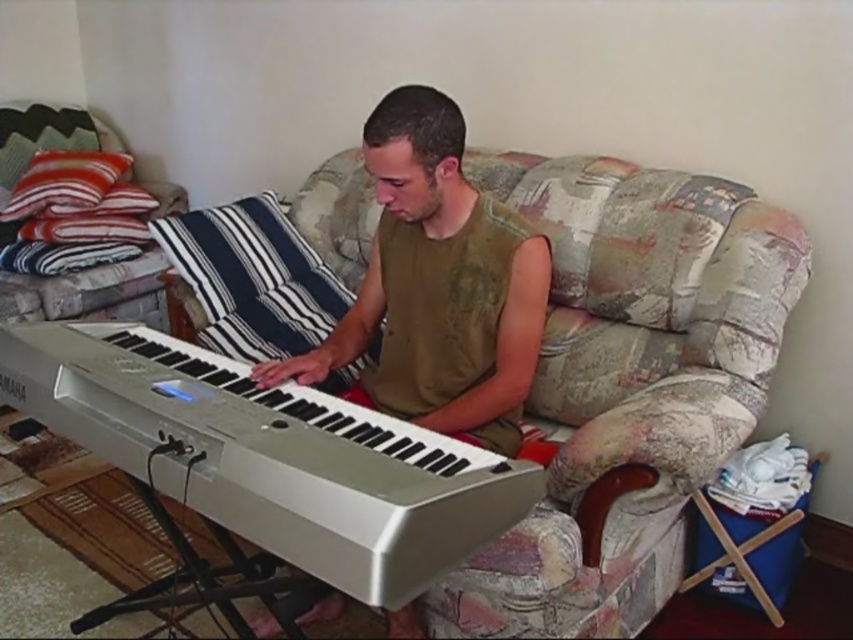
Is white plastic keyboard at center above matte green tank top at center?

Actually, white plastic keyboard at center is below matte green tank top at center.

Is point (178, 492) positioned in front of point (367, 269)?

That is True.

I want to click on white plastic keyboard at center, so pos(270,456).

This screenshot has width=853, height=640. I want to click on white plastic keyboard at center, so click(x=270, y=456).

Is patterned fabric couch at center below white plastic keyboard at center?

No, patterned fabric couch at center is not below white plastic keyboard at center.

Who is shorter, patterned fabric couch at center or white plastic keyboard at center?

white plastic keyboard at center

This screenshot has height=640, width=853. What do you see at coordinates (631, 371) in the screenshot?
I see `patterned fabric couch at center` at bounding box center [631, 371].

Locate an element on the screen. patterned fabric couch at center is located at coordinates (631, 371).

Does patterned fabric couch at center have a larger size compared to striped fabric pillow at upper left?

Indeed, patterned fabric couch at center has a larger size compared to striped fabric pillow at upper left.

Where is `patterned fabric couch at center`? This screenshot has width=853, height=640. patterned fabric couch at center is located at coordinates (631, 371).